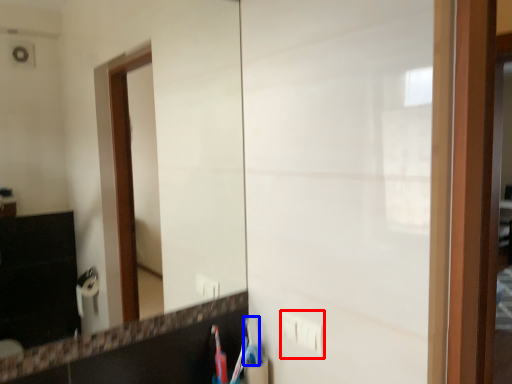
Question: Which object appears farthest to the camera in this image, electric outlet (highlighted by a red box) or toothbrush (highlighted by a blue box)?

Choices:
 (A) electric outlet
 (B) toothbrush

Answer: (B)